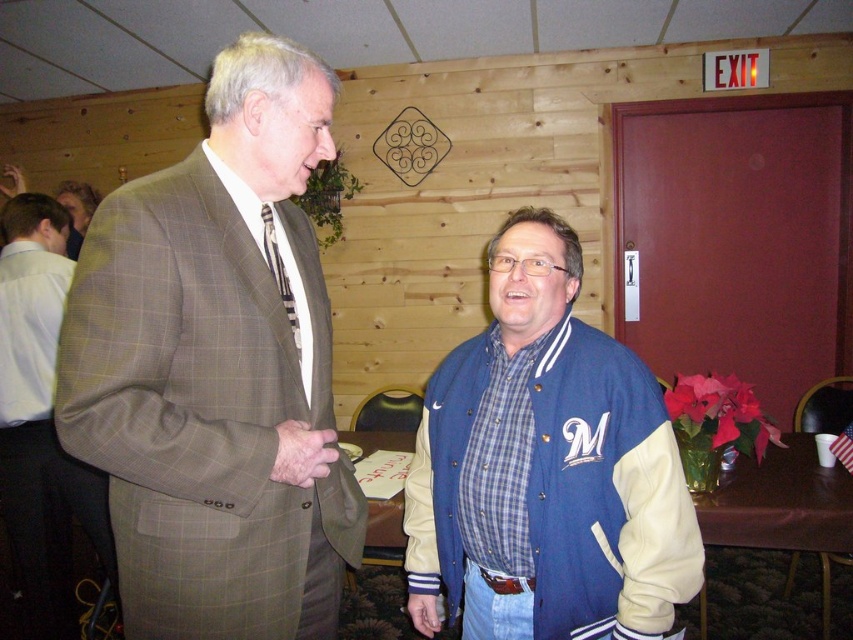
You are standing in the room and want to determine which of the two points, point [521,253] or point [78,237], is nearer to you. Based on the scene description, which point is closer?

Point [521,253] is closer to the viewer than point [78,237].